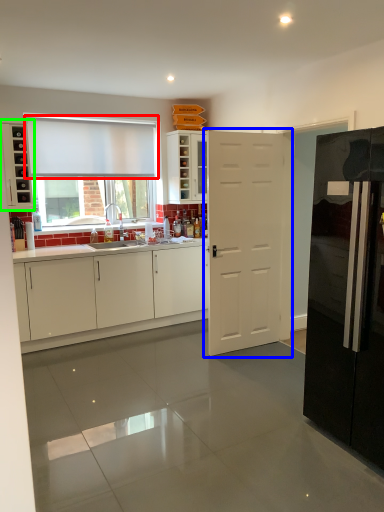
Question: Based on their relative distances, which object is farther from curtain (highlighted by a red box)? Choose from door (highlighted by a blue box) and cabinetry (highlighted by a green box).

Choices:
 (A) door
 (B) cabinetry

Answer: (A)